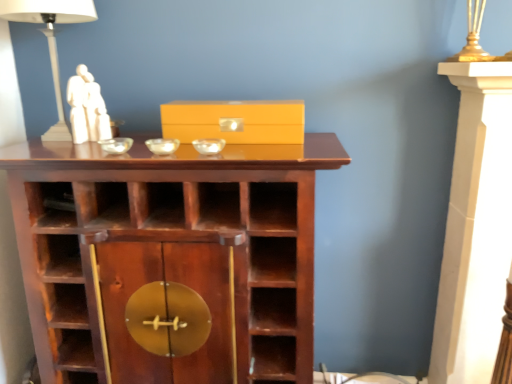
I want to click on free spot to the right of clear glass bowl at center, acting as the third glass bowl starting from the right, so click(190, 140).